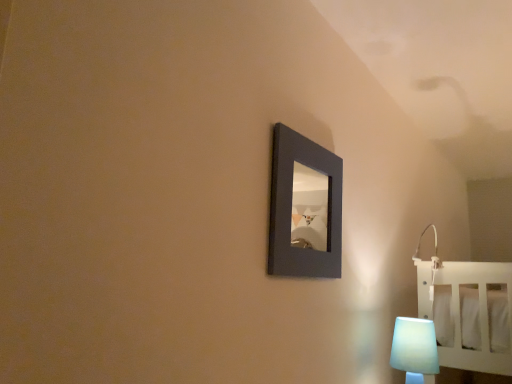
Question: From the image's perspective, is translucent white lampshade at lower right above or below matte black picture frame at center?

Choices:
 (A) below
 (B) above

Answer: (A)

Question: In the image, is translucent white lampshade at lower right positioned in front of or behind matte black picture frame at center?

Choices:
 (A) behind
 (B) front

Answer: (A)

Question: Based on their sizes in the image, would you say translucent white lampshade at lower right is bigger or smaller than matte black picture frame at center?

Choices:
 (A) big
 (B) small

Answer: (B)

Question: Looking at their shapes, would you say matte black picture frame at center is wider or thinner than translucent white lampshade at lower right?

Choices:
 (A) wide
 (B) thin

Answer: (B)

Question: Considering the relative positions of matte black picture frame at center and translucent white lampshade at lower right in the image provided, is matte black picture frame at center to the left or to the right of translucent white lampshade at lower right?

Choices:
 (A) right
 (B) left

Answer: (B)

Question: Is point (270, 248) positioned closer to the camera than point (418, 374)?

Choices:
 (A) closer
 (B) farther

Answer: (A)

Question: Which is correct: matte black picture frame at center is inside translucent white lampshade at lower right, or outside of it?

Choices:
 (A) inside
 (B) outside

Answer: (B)